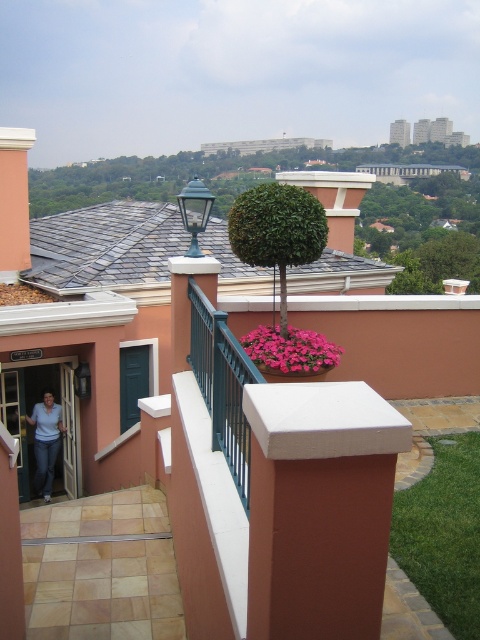
Is green textured ball at upper center in front of green leafy tree at center?

That is False.

Based on the photo, which is more to the left, green textured ball at upper center or green leafy tree at center?

Positioned to the left is green leafy tree at center.

Does point (409, 193) come farther from viewer compared to point (323, 240)?

Yes, point (409, 193) is behind point (323, 240).

What are the coordinates of `green textured ball at upper center` in the screenshot? It's located at (303, 168).

Can you confirm if green textured ball at upper center is taller than teal metal/rail at center?

Yes, green textured ball at upper center is taller than teal metal/rail at center.

Can you confirm if green textured ball at upper center is shorter than teal metal/rail at center?

No.

At what (x,y) coordinates should I click in order to perform the action: click on green textured ball at upper center. Please return your answer as a coordinate pair (x, y). The image size is (480, 640). Looking at the image, I should click on coord(303,168).

The image size is (480, 640). Identify the location of green textured ball at upper center. (303, 168).

Is teal metal/rail at center shorter than denim jeans at left?

Yes.

The image size is (480, 640). What are the coordinates of `teal metal/rail at center` in the screenshot? It's located at (223, 385).

Is point (222, 332) closer to camera compared to point (48, 492)?

Yes.

The image size is (480, 640). What are the coordinates of `teal metal/rail at center` in the screenshot? It's located at (223, 385).